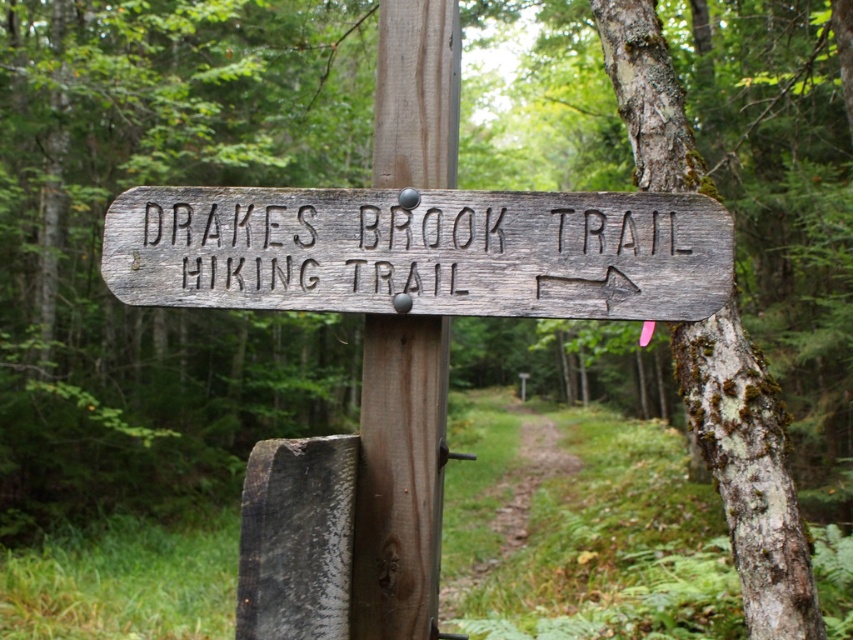
Between weathered wood sign at center and dirt path at center, which one is positioned lower?

dirt path at center is lower down.

What do you see at coordinates (421, 252) in the screenshot?
I see `weathered wood sign at center` at bounding box center [421, 252].

Who is more distant from viewer, (x=314, y=305) or (x=554, y=445)?

Positioned behind is point (x=554, y=445).

Where is `weathered wood sign at center`? weathered wood sign at center is located at coordinates (x=421, y=252).

Does weathered wood sign at center appear over brown wood pole at center?

Yes.

Who is more distant from viewer, (256, 202) or (444, 49)?

Positioned behind is point (444, 49).

The height and width of the screenshot is (640, 853). What are the coordinates of `weathered wood sign at center` in the screenshot? It's located at (421, 252).

Image resolution: width=853 pixels, height=640 pixels. Describe the element at coordinates (399, 477) in the screenshot. I see `brown wood pole at center` at that location.

Is brown wood pole at center below dirt path at center?

Actually, brown wood pole at center is above dirt path at center.

From the picture: Measure the distance between brown wood pole at center and camera.

brown wood pole at center and camera are 7.78 feet apart from each other.

At what (x,y) coordinates should I click in order to perform the action: click on brown wood pole at center. Please return your answer as a coordinate pair (x, y). The image size is (853, 640). Looking at the image, I should click on (399, 477).